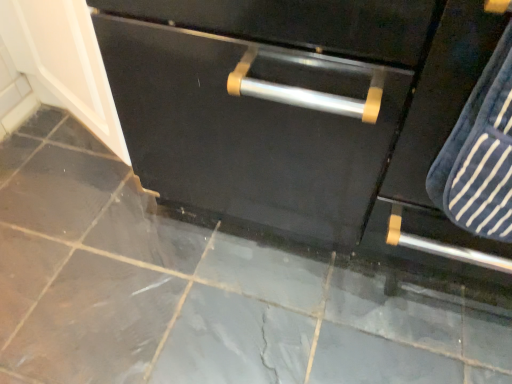
This screenshot has height=384, width=512. Describe the element at coordinates (302, 114) in the screenshot. I see `matte black cabinet at center` at that location.

Where is `matte black cabinet at center`? matte black cabinet at center is located at coordinates (302, 114).

Image resolution: width=512 pixels, height=384 pixels. I want to click on matte black cabinet at center, so click(x=302, y=114).